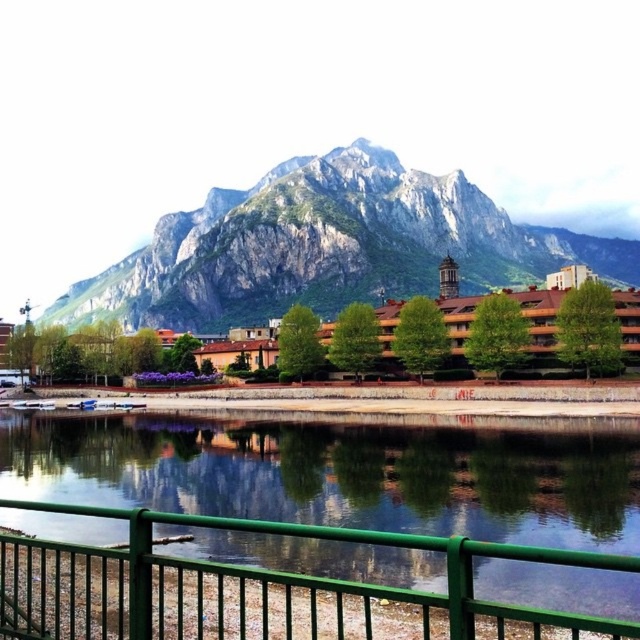
Question: Which is farther from the green metallic river at center?

Choices:
 (A) rugged stone mountain at upper center
 (B) brown wooden houses at center

Answer: (A)

Question: Is rugged stone mountain at upper center thinner than brown wooden houses at center?

Choices:
 (A) yes
 (B) no

Answer: (B)

Question: Can you confirm if rugged stone mountain at upper center is smaller than brown wooden houses at center?

Choices:
 (A) no
 (B) yes

Answer: (A)

Question: Which object is the farthest from the green metallic river at center?

Choices:
 (A) rugged stone mountain at upper center
 (B) brown wooden houses at center

Answer: (A)

Question: From the image, what is the correct spatial relationship of green metallic river at center in relation to brown wooden houses at center?

Choices:
 (A) right
 (B) left

Answer: (B)

Question: Which of the following is the farthest from the observer?

Choices:
 (A) (72, 440)
 (B) (164, 234)

Answer: (B)